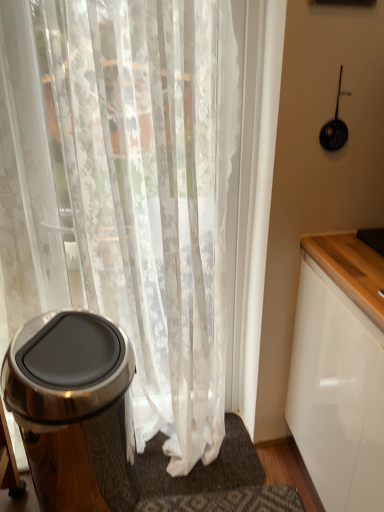
Question: Considering the relative positions of white textured bath mat at lower center and white sheer curtain at left in the image provided, is white textured bath mat at lower center to the left or to the right of white sheer curtain at left?

Choices:
 (A) right
 (B) left

Answer: (A)

Question: From the image's perspective, is white textured bath mat at lower center positioned above or below white sheer curtain at left?

Choices:
 (A) above
 (B) below

Answer: (B)

Question: Estimate the real-world distances between objects in this image. Which object is farther from the white sheer curtain at left?

Choices:
 (A) polished stainless steel trash can at left
 (B) white textured bath mat at lower center

Answer: (B)

Question: Which object is the closest to the polished stainless steel trash can at left?

Choices:
 (A) white sheer curtain at left
 (B) white textured bath mat at lower center

Answer: (A)